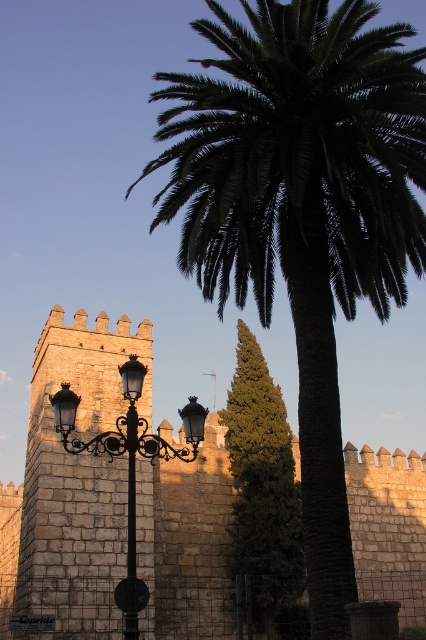
Image resolution: width=426 pixels, height=640 pixels. Describe the element at coordinates (264, 497) in the screenshot. I see `green textured pine tree at center` at that location.

Who is higher up, green textured pine tree at center or black wrought iron street light at center?

black wrought iron street light at center

The width and height of the screenshot is (426, 640). I want to click on green textured pine tree at center, so click(x=264, y=497).

Is green leafy palm at center smaller than black wrought iron street light at center?

Actually, green leafy palm at center might be larger than black wrought iron street light at center.

Does green leafy palm at center appear on the left side of black wrought iron street light at center?

Incorrect, green leafy palm at center is not on the left side of black wrought iron street light at center.

Who is more distant from viewer, [412,230] or [131,588]?

Point [412,230]

The width and height of the screenshot is (426, 640). I want to click on green leafy palm at center, so click(x=302, y=209).

Which is below, green leafy palm at center or stone wall at center?

Positioned lower is stone wall at center.

Does green leafy palm at center appear over stone wall at center?

Yes, green leafy palm at center is above stone wall at center.

Describe the element at coordinates (302, 209) in the screenshot. I see `green leafy palm at center` at that location.

Locate an element on the screen. Image resolution: width=426 pixels, height=640 pixels. green leafy palm at center is located at coordinates tap(302, 209).